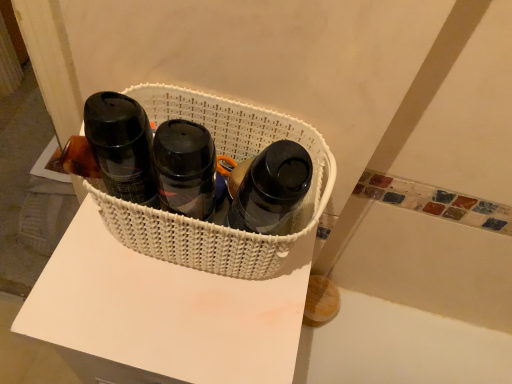
The image size is (512, 384). Find the location of `vacant space in front of matte black thermos at left, marked as the 1th bottle in a left-to-right arrangement`. vacant space in front of matte black thermos at left, marked as the 1th bottle in a left-to-right arrangement is located at coordinates (115, 316).